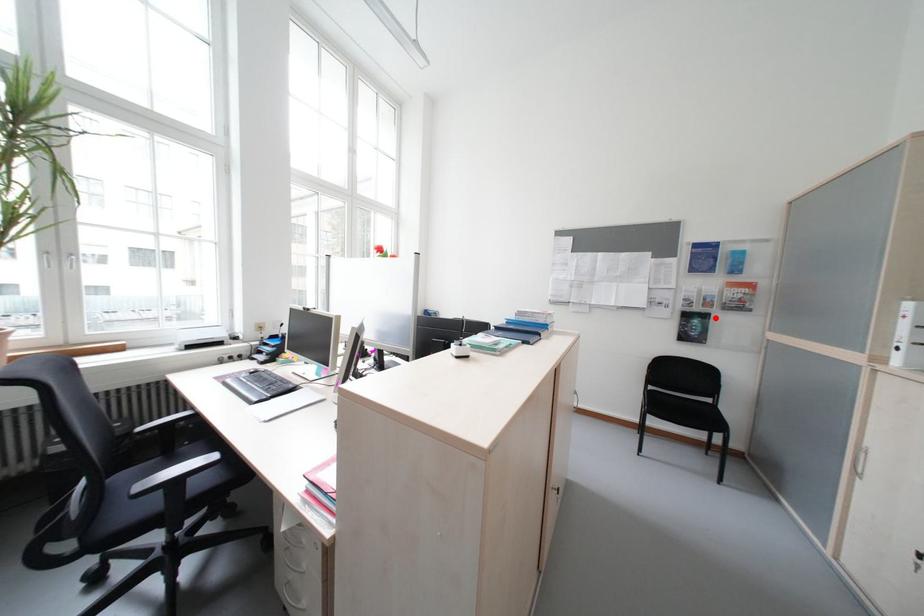
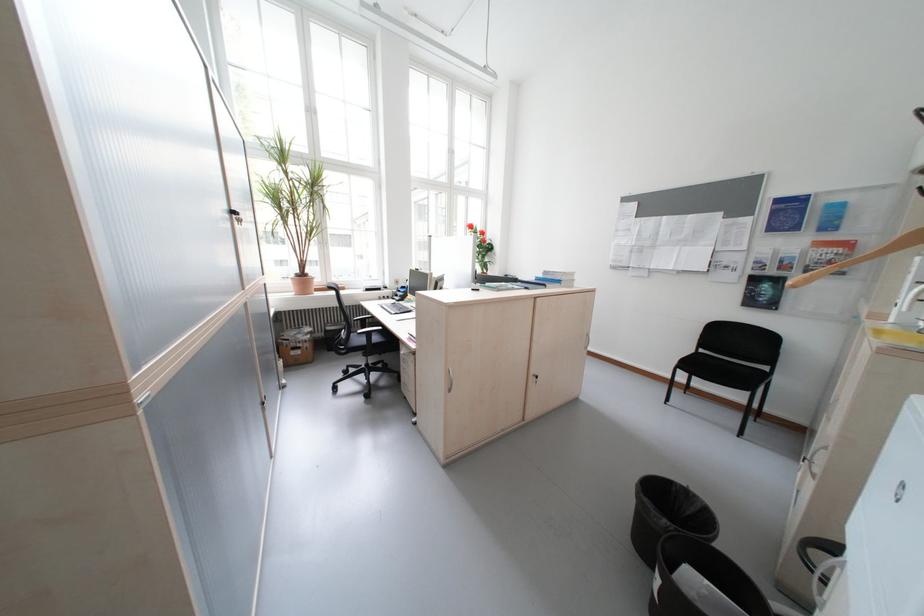
In the second image, find the point that corresponds to the highlighted location in the first image.

(788, 282)